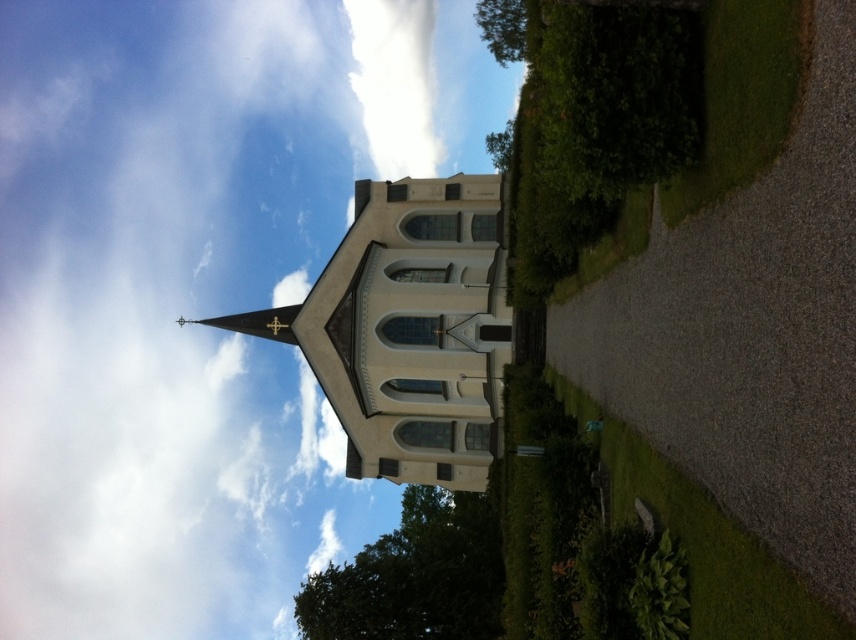
You are a bird flying at an altitude of 30 meters above the ground. You see the white fluffy cloud at upper left and the white smooth church steeple at center. Can you safely land on the church steeple without hitting the cloud?

The distance between the white fluffy cloud at upper left and the white smooth church steeple at center is 27.94 meters. Since you are flying at 30 meters altitude, you would be 2.06 meters below the cloud, so you can safely land on the church steeple without hitting the cloud.

You are standing on the gravel path leading to the church and looking up at the sky. Which object, the white fluffy cloud at upper left or the white smooth church steeple at center, appears higher in the sky?

The white fluffy cloud at upper left appears higher in the sky than the white smooth church steeple at center because it is taller than the steeple.